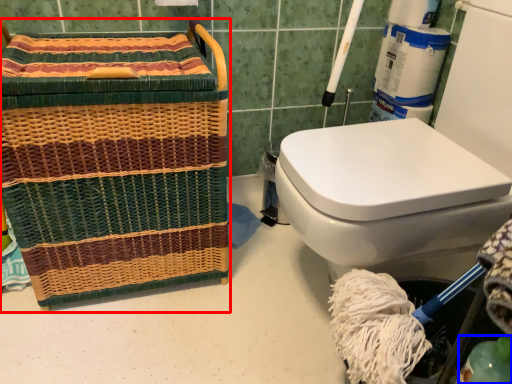
Question: Among these objects, which one is farthest to the camera, basket (highlighted by a red box) or teal (highlighted by a blue box)?

Choices:
 (A) basket
 (B) teal

Answer: (A)